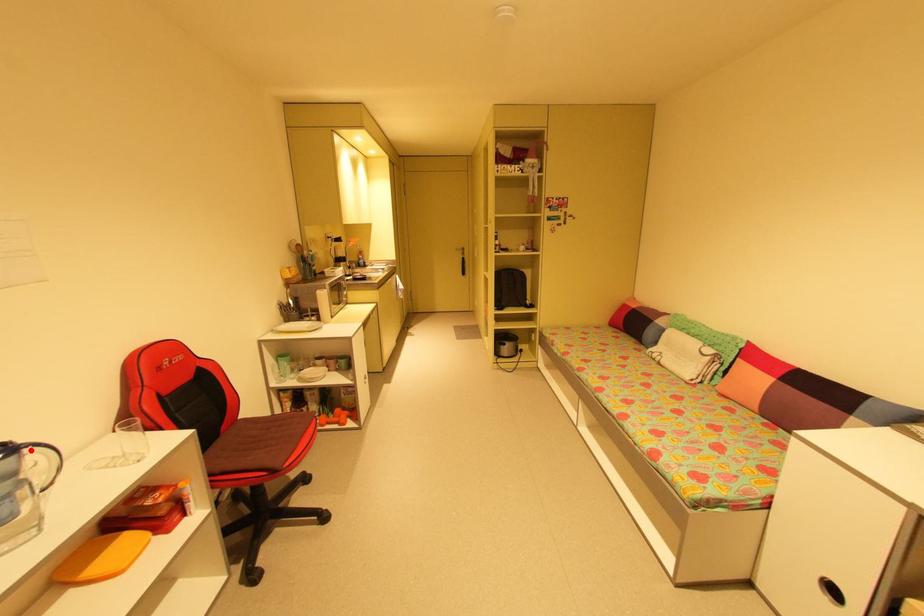
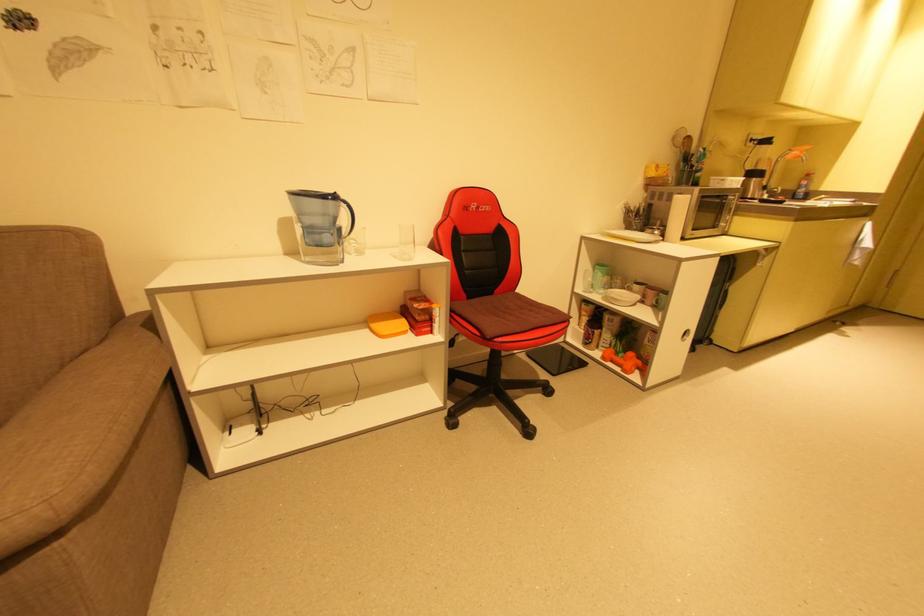
In the second image, find the point that corresponds to the highlighted location in the first image.

(346, 204)